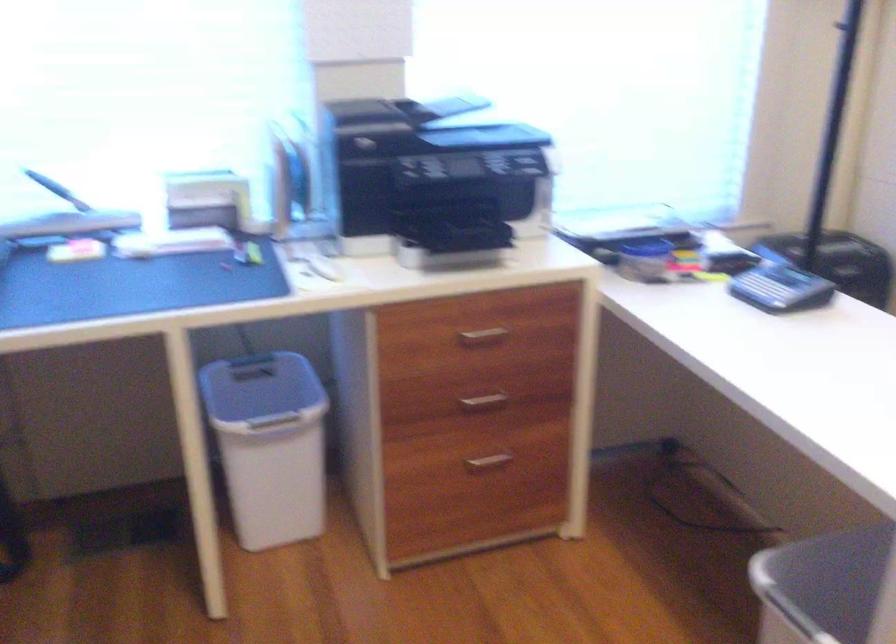
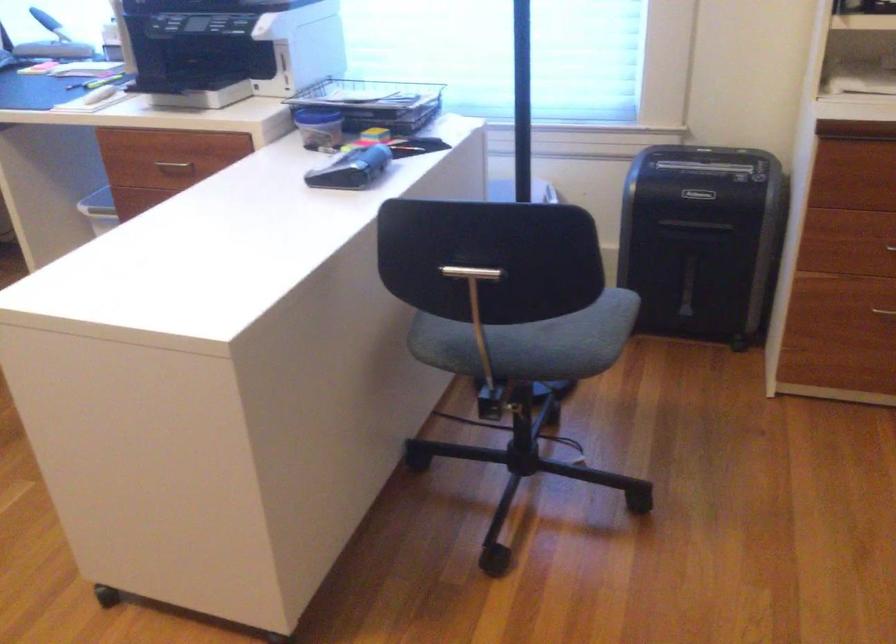
Question: I am providing you with two images of the same scene from different viewpoints. Please identify which objects are invisible in image2.

Choices:
 (A) green power tool
 (B) chair sitting surface
 (C) black tape dispenser
 (D) trash can lid

Answer: (D)